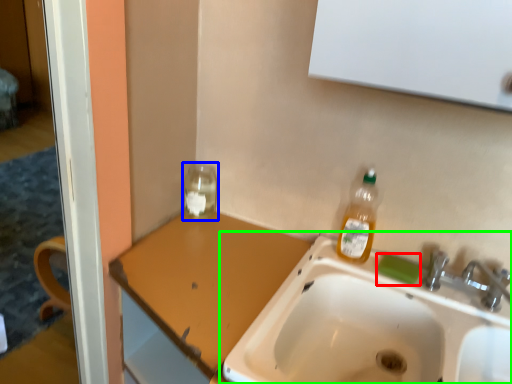
Question: Estimate the real-world distances between objects in this image. Which object is farther from soap (highlighted by a red box), glass jar (highlighted by a blue box) or sink (highlighted by a green box)?

Choices:
 (A) glass jar
 (B) sink

Answer: (A)